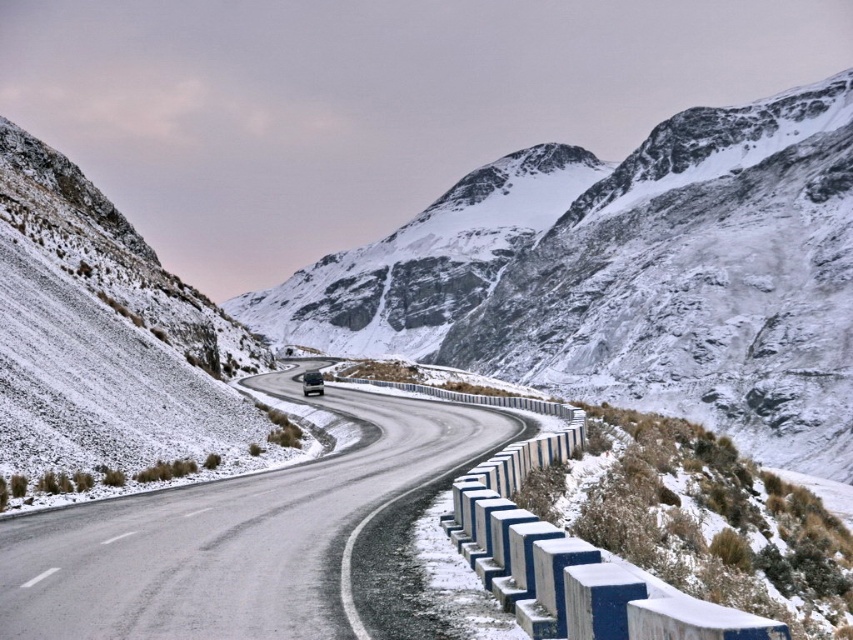
Does black asphalt road at center have a lesser width compared to dark gray metallic car at center?

In fact, black asphalt road at center might be wider than dark gray metallic car at center.

Can you confirm if black asphalt road at center is positioned to the right of dark gray metallic car at center?

Indeed, black asphalt road at center is positioned on the right side of dark gray metallic car at center.

The height and width of the screenshot is (640, 853). What do you see at coordinates (231, 534) in the screenshot?
I see `black asphalt road at center` at bounding box center [231, 534].

This screenshot has width=853, height=640. I want to click on black asphalt road at center, so click(x=231, y=534).